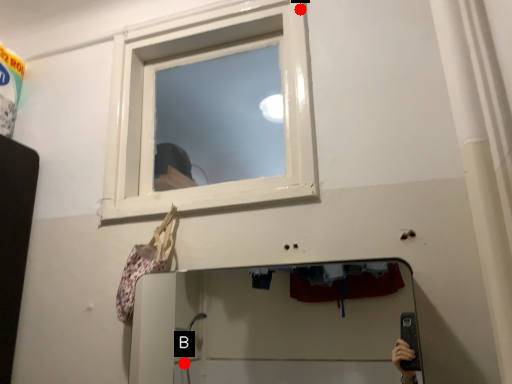
Question: Two points are circled on the image, labeled by A and B beside each circle. Which point is closer to the camera?

Choices:
 (A) A is closer
 (B) B is closer

Answer: (A)